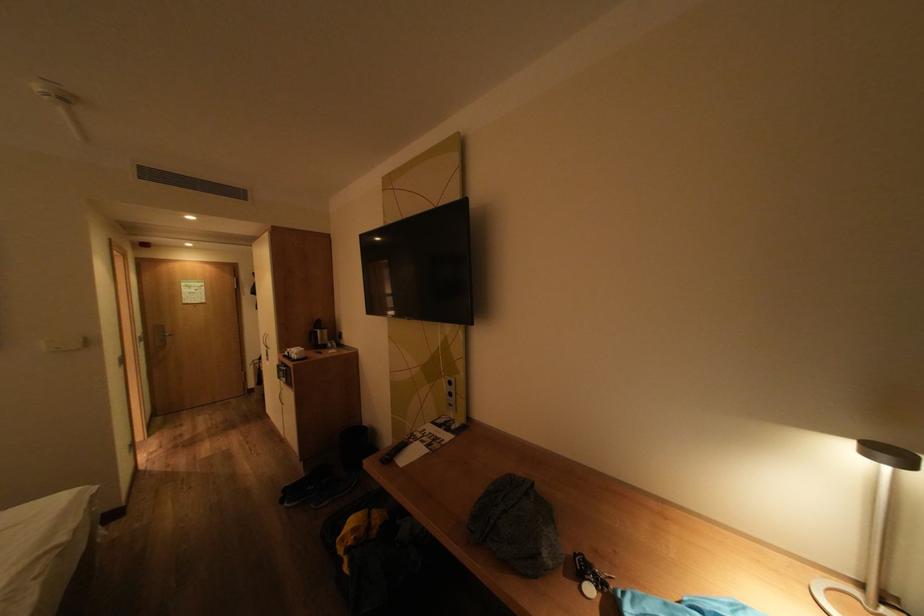
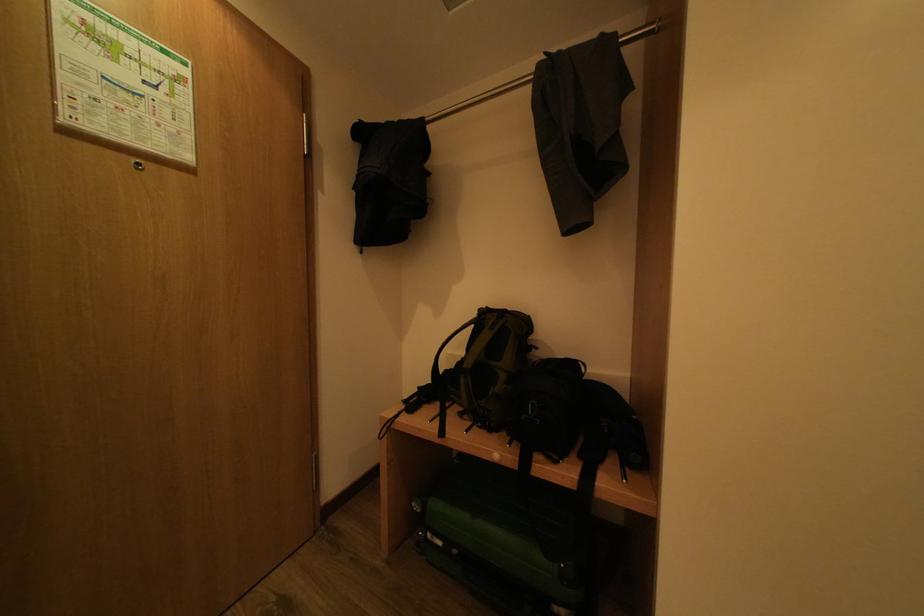
The images are taken continuously from a first-person perspective. In which direction are you moving?

The cameraman walked toward left, forward.